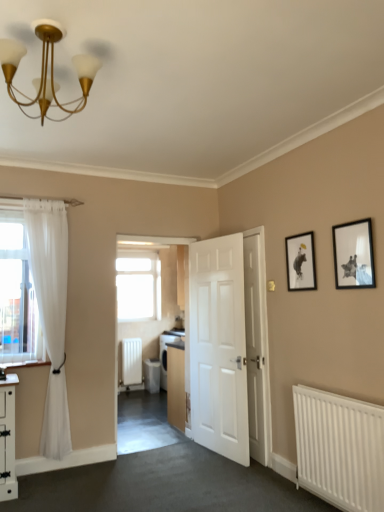
Question: Is white matte radiator at center, which is the 1th radiator from left to right, to the left of white glossy dishwasher at center from the viewer's perspective?

Choices:
 (A) no
 (B) yes

Answer: (B)

Question: Does white matte radiator at center, which is the 1th radiator from left to right, come behind white glossy dishwasher at center?

Choices:
 (A) yes
 (B) no

Answer: (A)

Question: From a real-world perspective, is white matte radiator at center, the 1th radiator positioned from the back, located beneath white glossy dishwasher at center?

Choices:
 (A) no
 (B) yes

Answer: (A)

Question: Can you confirm if white matte radiator at center, arranged as the 2th radiator when viewed from the front, is wider than white glossy dishwasher at center?

Choices:
 (A) yes
 (B) no

Answer: (B)

Question: Is white matte radiator at center, which is the 1th radiator from left to right, to the right of white glossy dishwasher at center from the viewer's perspective?

Choices:
 (A) yes
 (B) no

Answer: (B)

Question: From the image's perspective, is white glossy dishwasher at center located above or below white smooth door at center, placed as the 2th door when sorted from left to right?

Choices:
 (A) above
 (B) below

Answer: (B)

Question: Is white glossy dishwasher at center spatially inside white smooth door at center, placed as the 2th door when sorted from left to right, or outside of it?

Choices:
 (A) outside
 (B) inside

Answer: (A)

Question: Would you say white glossy dishwasher at center is to the left or to the right of white smooth door at center, placed as the 2th door when sorted from left to right, in the picture?

Choices:
 (A) right
 (B) left

Answer: (B)

Question: Is point (157, 367) positioned closer to the camera than point (253, 242)?

Choices:
 (A) closer
 (B) farther

Answer: (B)

Question: Is point (150, 359) closer or farther from the camera than point (125, 370)?

Choices:
 (A) farther
 (B) closer

Answer: (B)

Question: Considering the relative positions of white glossy dishwasher at center and white matte radiator at center, which is the 1th radiator from left to right, in the image provided, is white glossy dishwasher at center to the left or to the right of white matte radiator at center, which is the 1th radiator from left to right,?

Choices:
 (A) left
 (B) right

Answer: (B)

Question: From the image's perspective, is white glossy dishwasher at center positioned above or below white matte radiator at center, the 1th radiator positioned from the back?

Choices:
 (A) above
 (B) below

Answer: (B)

Question: Is white glossy dishwasher at center in front of or behind white matte radiator at center, the 1th radiator positioned from the back, in the image?

Choices:
 (A) front
 (B) behind

Answer: (A)

Question: From the image's perspective, relative to black matte picture frame at upper right, acting as the 1th picture frame starting from the front, is white smooth door at center, placed as the 2th door when sorted from left to right, above or below?

Choices:
 (A) above
 (B) below

Answer: (B)

Question: Would you say white smooth door at center, placed as the 2th door when sorted from left to right, is to the left or to the right of black matte picture frame at upper right, which is counted as the second picture frame, starting from the left, in the picture?

Choices:
 (A) left
 (B) right

Answer: (A)